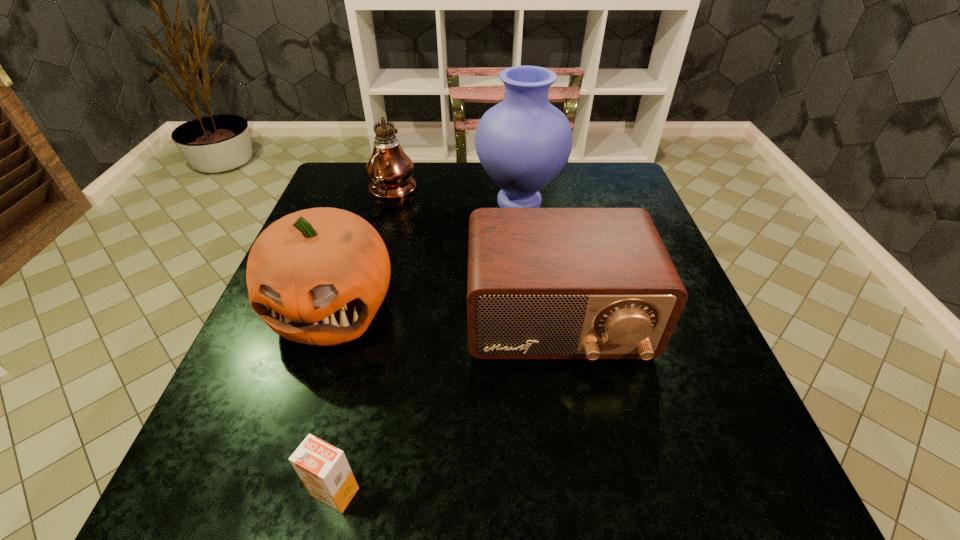
This screenshot has height=540, width=960. Find the location of `vacant space that is in between the radio receiver and the pumpkin`. vacant space that is in between the radio receiver and the pumpkin is located at coordinates (444, 313).

What are the coordinates of `free space between the vase and the pumpkin` in the screenshot? It's located at (426, 253).

Identify which object is the second closest to the pumpkin. Please provide its 2D coordinates. Your answer should be formatted as a tuple, i.e. [(x, y)], where the tuple contains the x and y coordinates of a point satisfying the conditions above.

[(523, 142)]

Identify the location of object that is the fourth closest one to the shortest object. This screenshot has width=960, height=540. (390, 170).

At what (x,y) coordinates should I click in order to perform the action: click on vacant region that satisfies the following two spatial constraints: 1. on the face of the nearest object; 2. on the right side of the pumpkin. Please return your answer as a coordinate pair (x, y). The height and width of the screenshot is (540, 960). Looking at the image, I should click on (270, 491).